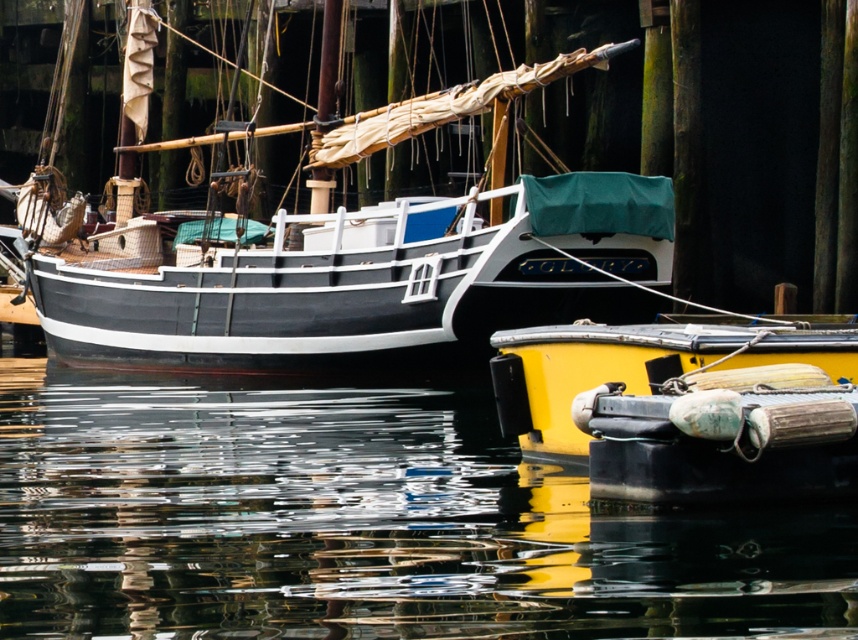
Does glossy water at lower center have a greater height compared to matte black sailboat at upper left?

Incorrect, glossy water at lower center's height is not larger of matte black sailboat at upper left's.

Find the location of a particular element. This screenshot has width=858, height=640. glossy water at lower center is located at coordinates (361, 524).

Can you confirm if glossy water at lower center is smaller than yellow matte buoy at lower right?

Actually, glossy water at lower center might be larger than yellow matte buoy at lower right.

Locate an element on the screen. This screenshot has width=858, height=640. glossy water at lower center is located at coordinates (361, 524).

Who is more distant from viewer, (319, 284) or (492, 362)?

Point (319, 284)

Where is `matte black sailboat at upper left`? The width and height of the screenshot is (858, 640). matte black sailboat at upper left is located at coordinates tap(372, 260).

Does point (464, 253) come in front of point (554, 364)?

No, it is behind (554, 364).

Identify the location of matte black sailboat at upper left. (372, 260).